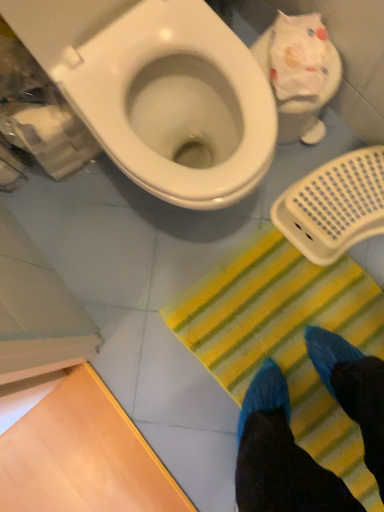
Question: From the image's perspective, does yellow striped mat at lower center appear lower than white plastic toilet at upper right, which is counted as the second toilet, starting from the left?

Choices:
 (A) yes
 (B) no

Answer: (A)

Question: Considering the relative positions of yellow striped mat at lower center and white plastic toilet at upper right, which is counted as the second toilet, starting from the left, in the image provided, is yellow striped mat at lower center in front of white plastic toilet at upper right, which is counted as the second toilet, starting from the left,?

Choices:
 (A) no
 (B) yes

Answer: (A)

Question: Are yellow striped mat at lower center and white plastic toilet at upper right, positioned as the first toilet in right-to-left order, far apart?

Choices:
 (A) yes
 (B) no

Answer: (B)

Question: Is yellow striped mat at lower center looking in the opposite direction of white plastic toilet at upper right, positioned as the first toilet in right-to-left order?

Choices:
 (A) no
 (B) yes

Answer: (A)

Question: From a real-world perspective, is yellow striped mat at lower center on top of white plastic toilet at upper right, which is counted as the second toilet, starting from the left?

Choices:
 (A) yes
 (B) no

Answer: (B)

Question: Does yellow striped mat at lower center have a greater width compared to white plastic toilet at upper right, positioned as the first toilet in right-to-left order?

Choices:
 (A) no
 (B) yes

Answer: (B)

Question: Could white glossy toilet at upper left, the first toilet viewed from the left, be considered to be inside white plastic toilet at upper right, which is counted as the second toilet, starting from the left?

Choices:
 (A) no
 (B) yes

Answer: (A)

Question: Is white plastic toilet at upper right, positioned as the first toilet in right-to-left order, at the right side of white glossy toilet at upper left, the first toilet viewed from the left?

Choices:
 (A) no
 (B) yes

Answer: (B)

Question: Is white plastic toilet at upper right, which is counted as the second toilet, starting from the left, next to white glossy toilet at upper left, the first toilet viewed from the left?

Choices:
 (A) yes
 (B) no

Answer: (B)

Question: Is white plastic toilet at upper right, positioned as the first toilet in right-to-left order, completely or partially outside of white glossy toilet at upper left, the first toilet viewed from the left?

Choices:
 (A) yes
 (B) no

Answer: (A)

Question: Are white plastic toilet at upper right, which is counted as the second toilet, starting from the left, and white glossy toilet at upper left, the 2th toilet from the right, located far from each other?

Choices:
 (A) no
 (B) yes

Answer: (A)

Question: Considering the relative sizes of white plastic toilet at upper right, which is counted as the second toilet, starting from the left, and white glossy toilet at upper left, the 2th toilet from the right, in the image provided, is white plastic toilet at upper right, which is counted as the second toilet, starting from the left, taller than white glossy toilet at upper left, the 2th toilet from the right,?

Choices:
 (A) no
 (B) yes

Answer: (A)

Question: Is white glossy toilet at upper left, the first toilet viewed from the left, taller than yellow striped mat at lower center?

Choices:
 (A) yes
 (B) no

Answer: (A)